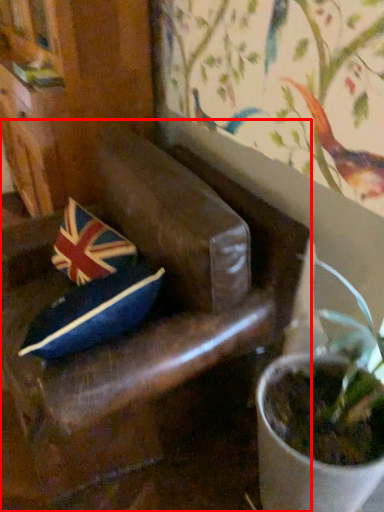
Question: Observing the image, what is the correct spatial positioning of chair (annotated by the red box) in reference to flag?

Choices:
 (A) right
 (B) left

Answer: (A)